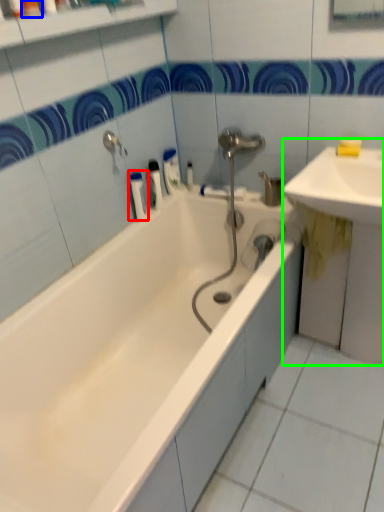
Question: Which object is positioned closest to toiletry (highlighted by a red box)? Select from toiletry (highlighted by a blue box) and sink (highlighted by a green box).

Choices:
 (A) toiletry
 (B) sink

Answer: (A)